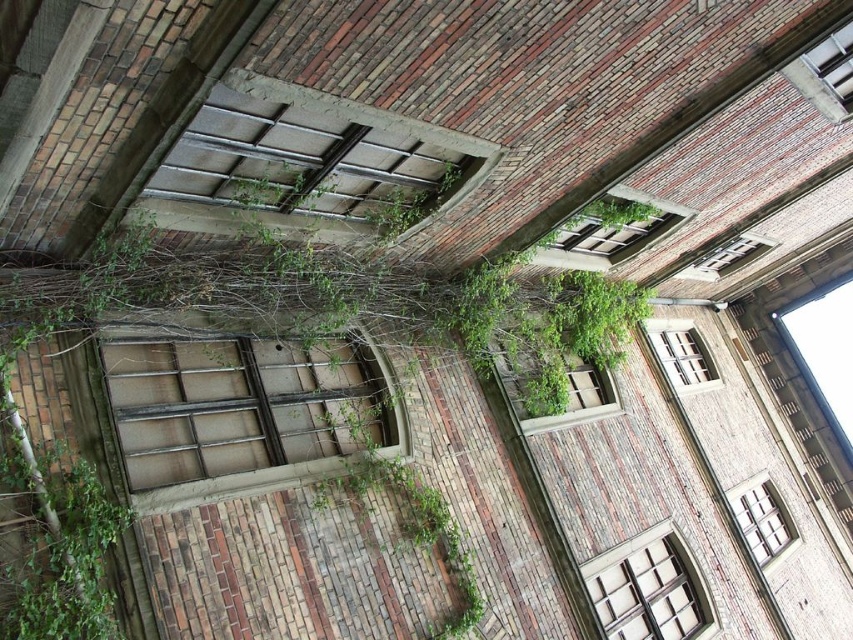
You are a window cleaner with a ladder that can reach up to 4 meters. You need to clean the window next to the green leafy plant at center. Can you safely reach the window without needing a taller ladder?

The distance between the green leafy plant at center and the window is 4.66 meters, which exceeds the ladder height of 4 meters. Therefore, you cannot safely reach the window without a taller ladder.

You are standing in front of the brick building and notice two points marked on the wall. The first point is at coordinates point (59, 298) and the second is at point (541, 417). Which point is closer to you?

Point (59, 298) is closer to the viewer than point (541, 417).

You are standing in front of the brick building and notice a point marked at coordinates [346,298]. What object is located at that point?

The point at coordinates [346,298] corresponds to a green leafy plant at center.